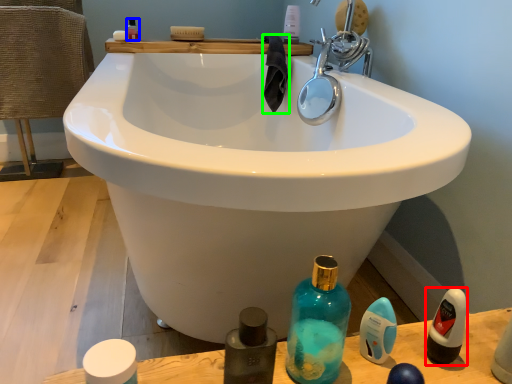
Question: Which object is the closest to the mouthwash (highlighted by a red box)? Choose among these: mouthwash (highlighted by a blue box) or material (highlighted by a green box).

Choices:
 (A) mouthwash
 (B) material

Answer: (B)